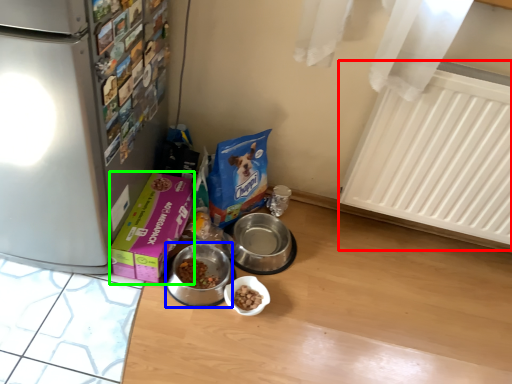
Question: Which object is the closest to the radiator (highlighted by a red box)? Choose among these: appliance (highlighted by a blue box) or box (highlighted by a green box).

Choices:
 (A) appliance
 (B) box

Answer: (A)